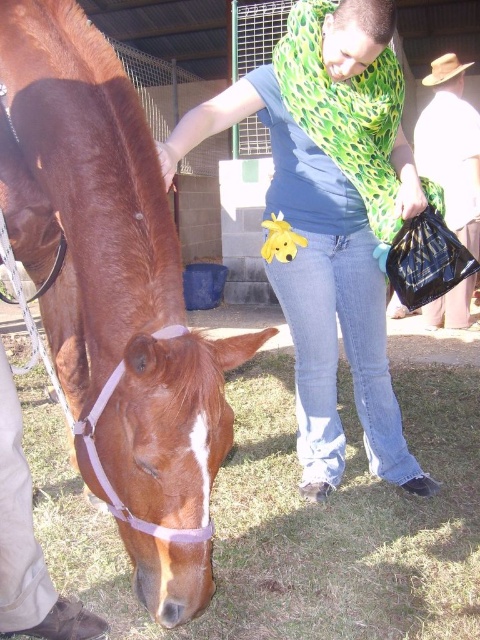
Between brown grass at lower center and brown woven hat at upper right, which one has less height?

brown grass at lower center is shorter.

Consider the image. Who is higher up, brown grass at lower center or brown woven hat at upper right?

brown woven hat at upper right is higher up.

Locate an element on the screen. brown grass at lower center is located at coordinates (295, 522).

What are the coordinates of `brown grass at lower center` in the screenshot? It's located at (295, 522).

Who is positioned more to the left, brown glossy horse at left or brown woven hat at upper right?

From the viewer's perspective, brown glossy horse at left appears more on the left side.

Measure the distance between brown glossy horse at left and camera.

brown glossy horse at left is 1.24 meters from camera.

Between point (86, 22) and point (416, 157), which one is positioned in front?

Positioned in front is point (86, 22).

Find the location of `brown glossy horse at left`. brown glossy horse at left is located at coordinates (115, 296).

Does green leopard print scarf at center have a smaller size compared to brown woven hat at upper right?

Actually, green leopard print scarf at center might be larger than brown woven hat at upper right.

At what (x,y) coordinates should I click in order to perform the action: click on green leopard print scarf at center. Please return your answer as a coordinate pair (x, y). The width and height of the screenshot is (480, 640). Looking at the image, I should click on (332, 221).